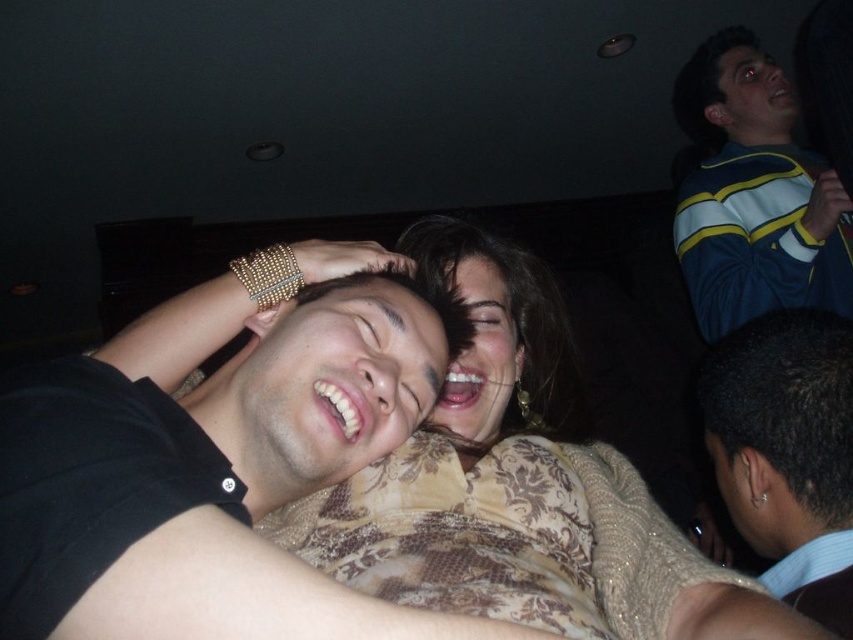
Who is higher up, gold textured sweater at center or black leather jacket at lower right?

gold textured sweater at center is higher up.

Is point (639, 552) positioned after point (762, 532)?

That is False.

Identify the location of gold textured sweater at center. The width and height of the screenshot is (853, 640). (514, 483).

Who is lower down, gold textured sweater at center or blue and yellow striped sweater at upper right?

gold textured sweater at center is lower down.

Does gold textured sweater at center come behind blue and yellow striped sweater at upper right?

No, it is not.

Which is behind, point (492, 314) or point (788, 108)?

The point (788, 108) is behind.

Where is `gold textured sweater at center`? Image resolution: width=853 pixels, height=640 pixels. gold textured sweater at center is located at coordinates (514, 483).

Which is behind, point (347, 634) or point (556, 400)?

Positioned behind is point (556, 400).

Between black shirt at center and gold textured sweater at center, which one appears on the left side from the viewer's perspective?

Positioned to the left is black shirt at center.

What do you see at coordinates (225, 468) in the screenshot? This screenshot has height=640, width=853. I see `black shirt at center` at bounding box center [225, 468].

At what (x,y) coordinates should I click in order to perform the action: click on black shirt at center. Please return your answer as a coordinate pair (x, y). The image size is (853, 640). Looking at the image, I should click on (225, 468).